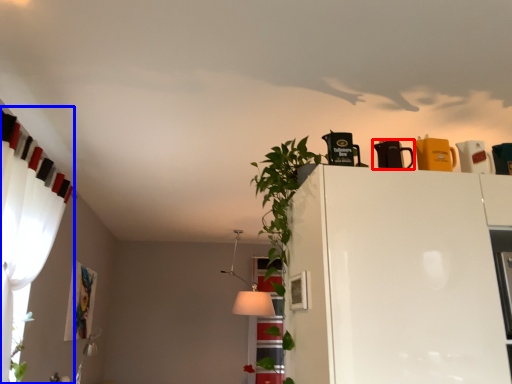
Question: Which point is closer to the camera, appliance (highlighted by a red box) or curtain (highlighted by a blue box)?

Choices:
 (A) appliance
 (B) curtain

Answer: (B)